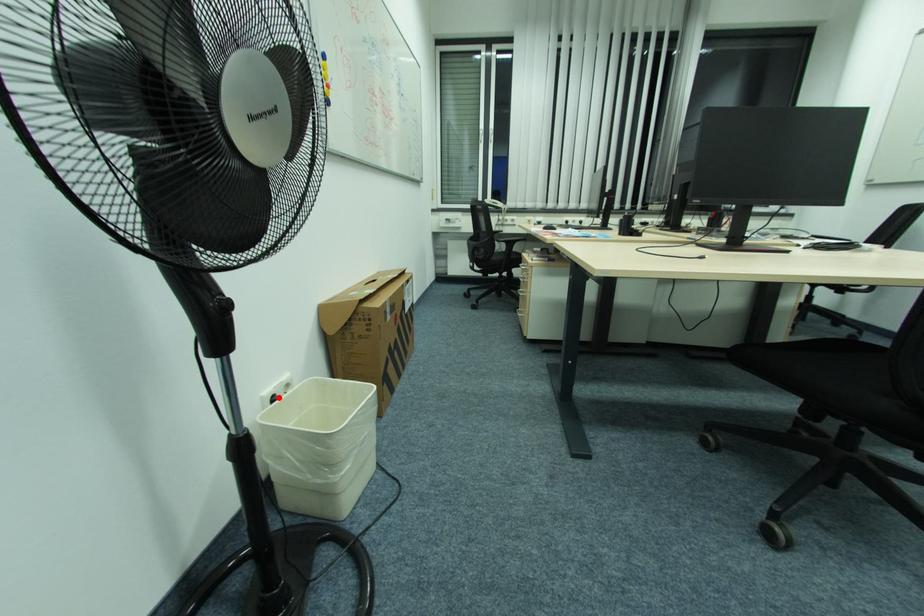
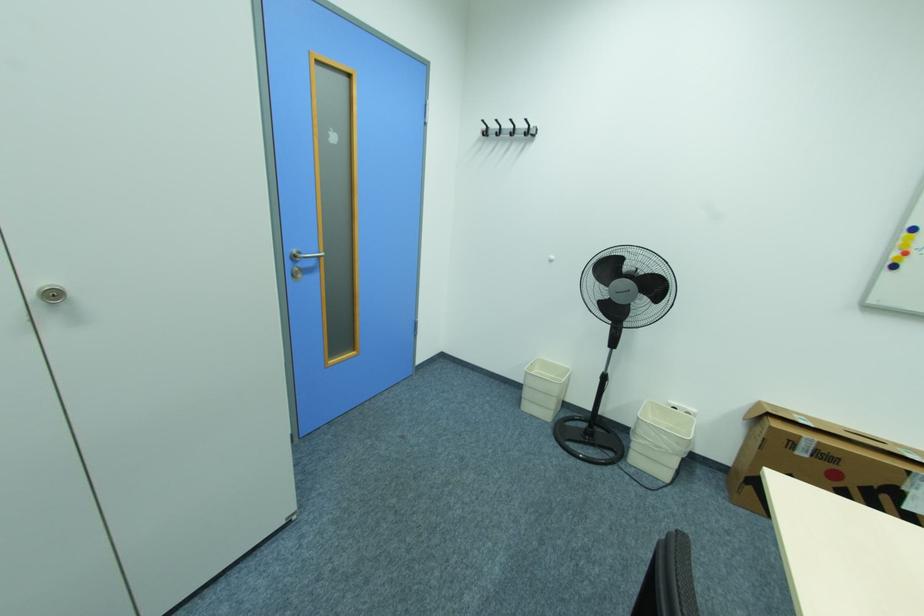
Where in the second image is the point corresponding to the highlighted location from the first image?

(679, 408)